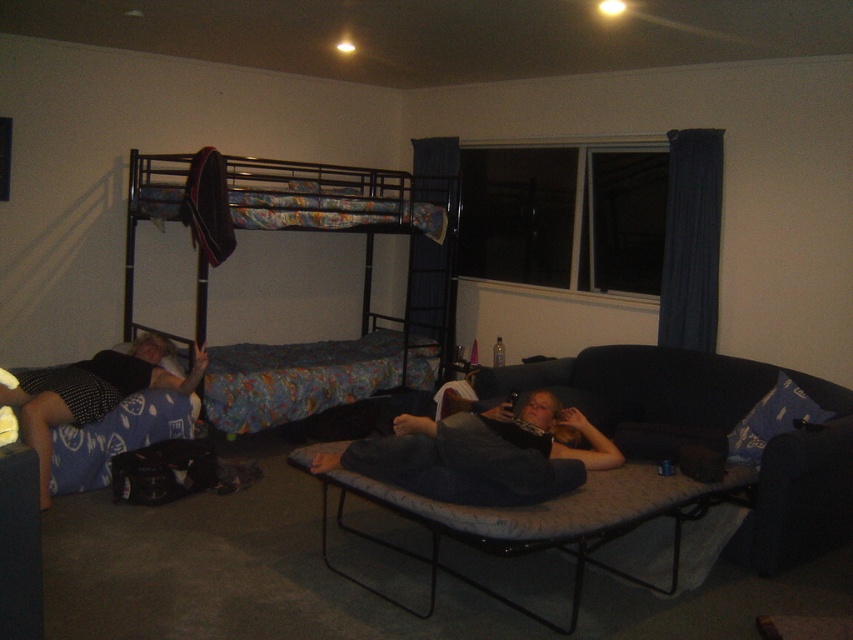
Question: Is gray fabric couch at lower right further to the viewer compared to blue fabric pillow at lower right?

Choices:
 (A) no
 (B) yes

Answer: (A)

Question: Among these points, which one is nearest to the camera?

Choices:
 (A) (476, 406)
 (B) (379, 464)
 (C) (756, 408)

Answer: (B)

Question: Is dark fabric couch at lower right behind blue fabric pillow at lower right?

Choices:
 (A) no
 (B) yes

Answer: (A)

Question: Does dark fabric couch at lower right lie in front of blue fabric pillow at lower right?

Choices:
 (A) yes
 (B) no

Answer: (A)

Question: Which object is closer to the camera taking this photo?

Choices:
 (A) matte black blanket at lower left
 (B) dark fabric couch at lower right

Answer: (B)

Question: Which of the following is the farthest from the observer?

Choices:
 (A) (370, 358)
 (B) (199, 355)
 (C) (453, 474)
 (D) (851, 449)

Answer: (A)